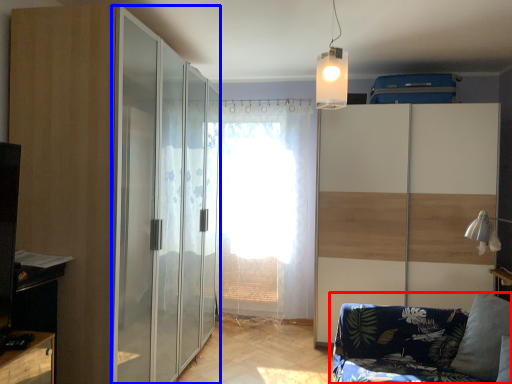
Question: Which object appears farthest to the camera in this image, studio couch (highlighted by a red box) or screen door (highlighted by a blue box)?

Choices:
 (A) studio couch
 (B) screen door

Answer: (B)